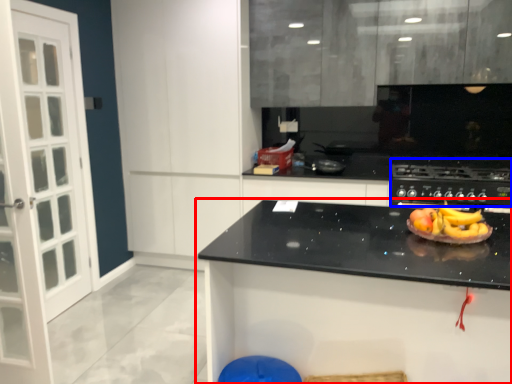
Question: Among these objects, which one is farthest to the camera, countertop (highlighted by a red box) or gas stove (highlighted by a blue box)?

Choices:
 (A) countertop
 (B) gas stove

Answer: (B)